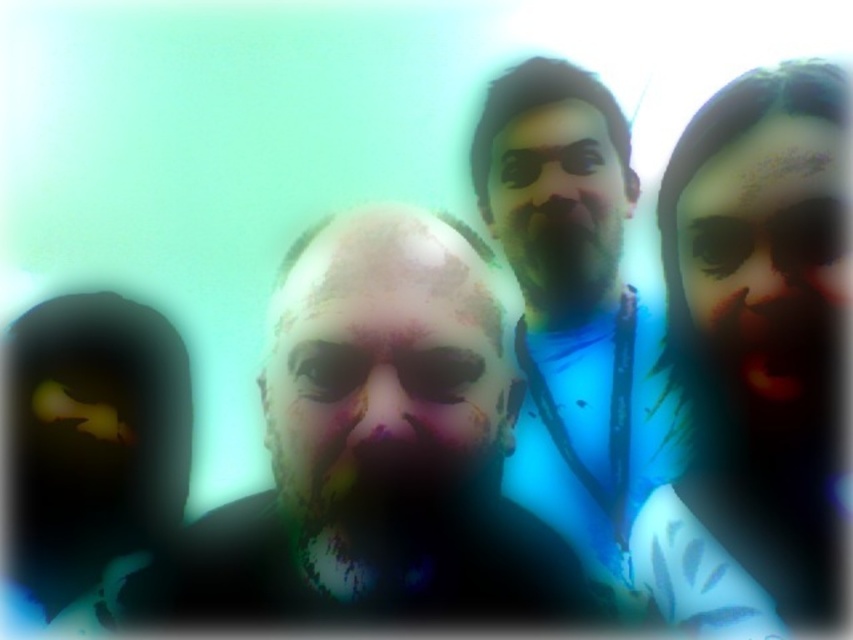
Question: Which object appears farthest from the camera in this image?

Choices:
 (A) smooth skin face at center
 (B) blue fabric shirt at center

Answer: (A)

Question: Observing the image, what is the correct spatial positioning of blue fabric shirt at center in reference to smooth skin face at center?

Choices:
 (A) below
 (B) above

Answer: (A)

Question: Does smooth skin face at right lie behind smooth skin face at center?

Choices:
 (A) yes
 (B) no

Answer: (B)

Question: In this image, where is dark skin face at center located relative to smooth skin face at center?

Choices:
 (A) above
 (B) below

Answer: (B)

Question: Which point is closer to the camera taking this photo?

Choices:
 (A) (755, 285)
 (B) (485, 436)

Answer: (B)

Question: Which object appears farthest from the camera in this image?

Choices:
 (A) blue fabric shirt at center
 (B) smooth skin face at center
 (C) beige textured face at center
 (D) dark skin face at center

Answer: (B)